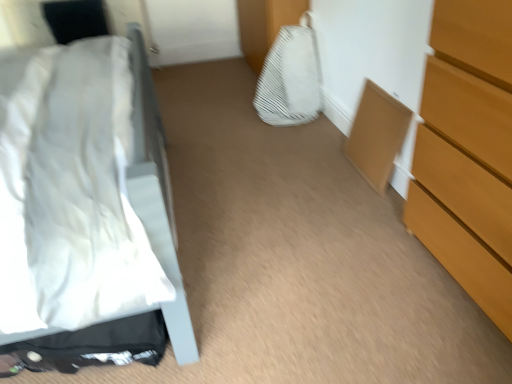
Question: Does wooden chest of drawers at right contain white matte bed at left?

Choices:
 (A) no
 (B) yes

Answer: (A)

Question: Considering the relative sizes of wooden chest of drawers at right and white matte bed at left in the image provided, is wooden chest of drawers at right shorter than white matte bed at left?

Choices:
 (A) yes
 (B) no

Answer: (A)

Question: From the image's perspective, is wooden chest of drawers at right over white matte bed at left?

Choices:
 (A) no
 (B) yes

Answer: (A)

Question: Is wooden chest of drawers at right positioned beyond the bounds of white matte bed at left?

Choices:
 (A) no
 (B) yes

Answer: (B)

Question: From a real-world perspective, does wooden chest of drawers at right stand above white matte bed at left?

Choices:
 (A) no
 (B) yes

Answer: (A)

Question: Does wooden chest of drawers at right have a smaller size compared to white matte bed at left?

Choices:
 (A) no
 (B) yes

Answer: (B)

Question: Is matte wood cabinet at lower right to the right of white matte bed at left from the viewer's perspective?

Choices:
 (A) no
 (B) yes

Answer: (B)

Question: From a real-world perspective, is matte wood cabinet at lower right located beneath white matte bed at left?

Choices:
 (A) yes
 (B) no

Answer: (A)

Question: Considering the relative sizes of matte wood cabinet at lower right and white matte bed at left in the image provided, is matte wood cabinet at lower right shorter than white matte bed at left?

Choices:
 (A) no
 (B) yes

Answer: (B)

Question: Does matte wood cabinet at lower right have a larger size compared to white matte bed at left?

Choices:
 (A) no
 (B) yes

Answer: (A)

Question: From a real-world perspective, is matte wood cabinet at lower right positioned over white matte bed at left based on gravity?

Choices:
 (A) no
 (B) yes

Answer: (A)

Question: Could you tell me if matte wood cabinet at lower right is turned towards white matte bed at left?

Choices:
 (A) yes
 (B) no

Answer: (A)

Question: Can you confirm if white textured fabric at center is positioned to the right of white matte bed at left?

Choices:
 (A) no
 (B) yes

Answer: (B)